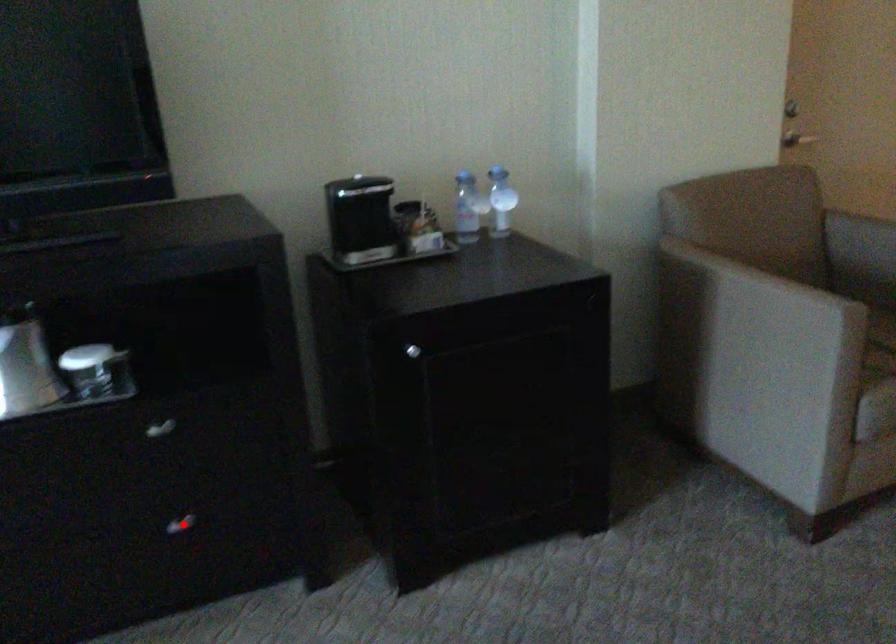
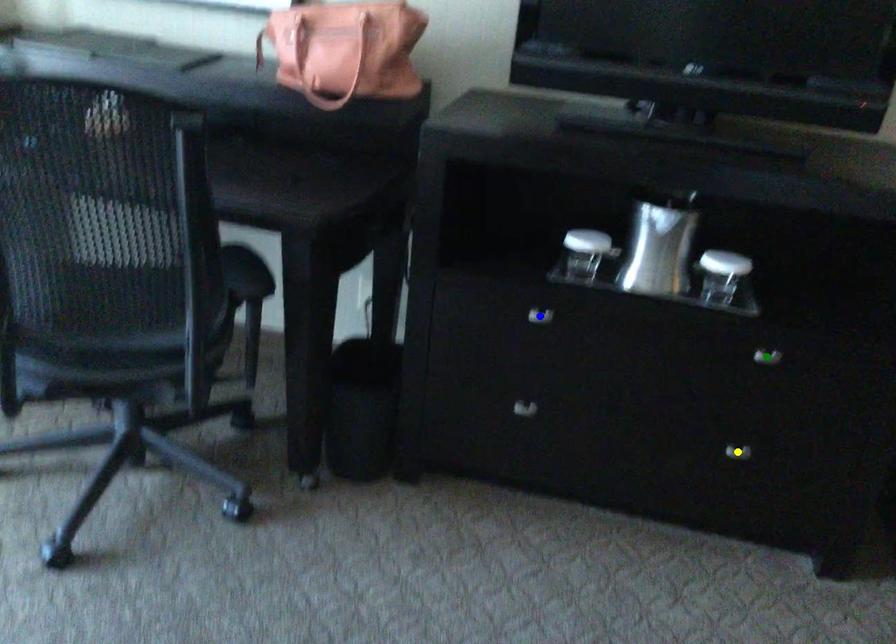
Question: I am providing you with two images of the same scene from different viewpoints. A red point is marked on the first image. You are given multiple points on the second image. In image 2, which mark is for the same physical point as the one in image 1?

Choices:
 (A) green point
 (B) yellow point
 (C) blue point

Answer: (B)